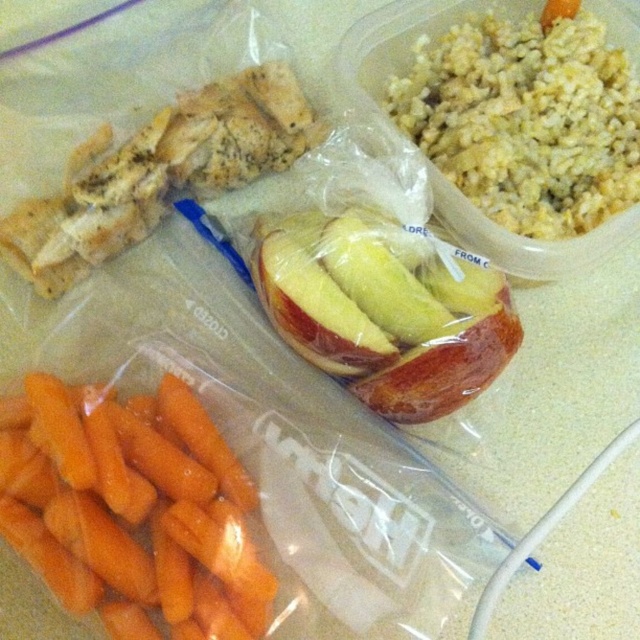
You are preparing a meal and need to arrange the yellowish rice at upper right and the red glossy apple at center on a plate. Since the plate has limited space, which item should you place first to ensure both fit?

The yellowish rice at upper right has a smaller width than the red glossy apple at center, so you should place the red glossy apple at center first to accommodate its larger size, then fit the yellowish rice at upper right next to it.

You are a chef preparing a meal and want to place a garnish on the dish closest to you. Which dish should you choose between the yellowish rice at upper right and the red glossy apple at center?

The yellowish rice at upper right is closer to the viewer, so you should choose the yellowish rice at upper right to place the garnish.

You are a food stylist arranging a healthy meal on a countertop. You have an orange smooth skin carrots at lower left and a red glossy apple at center. Where should you place a new bowl of hummus to ensure it is between the two vegetables?

The orange smooth skin carrots at lower left is located below the red glossy apple at center, so placing the hummus bowl between them would require positioning it above the carrots and below the apple.